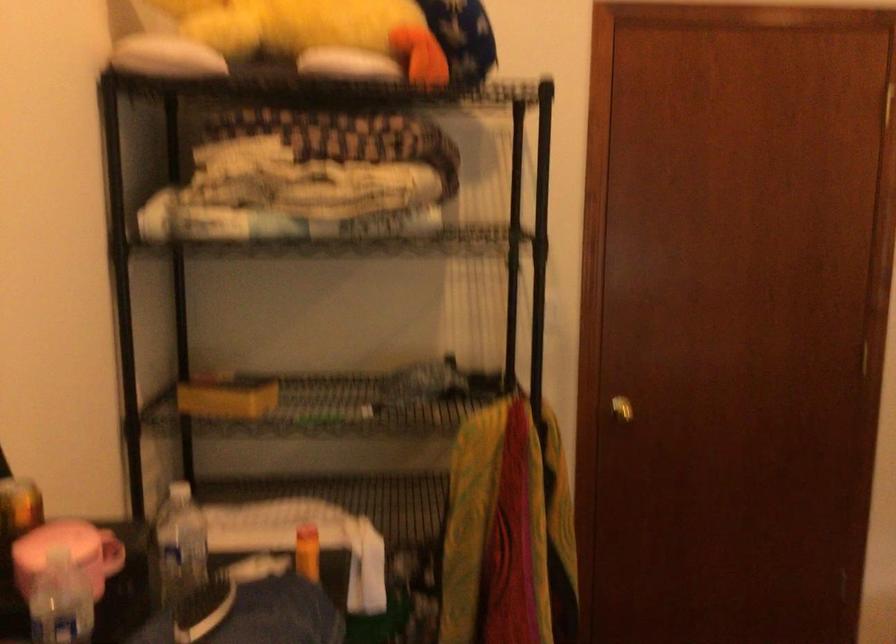
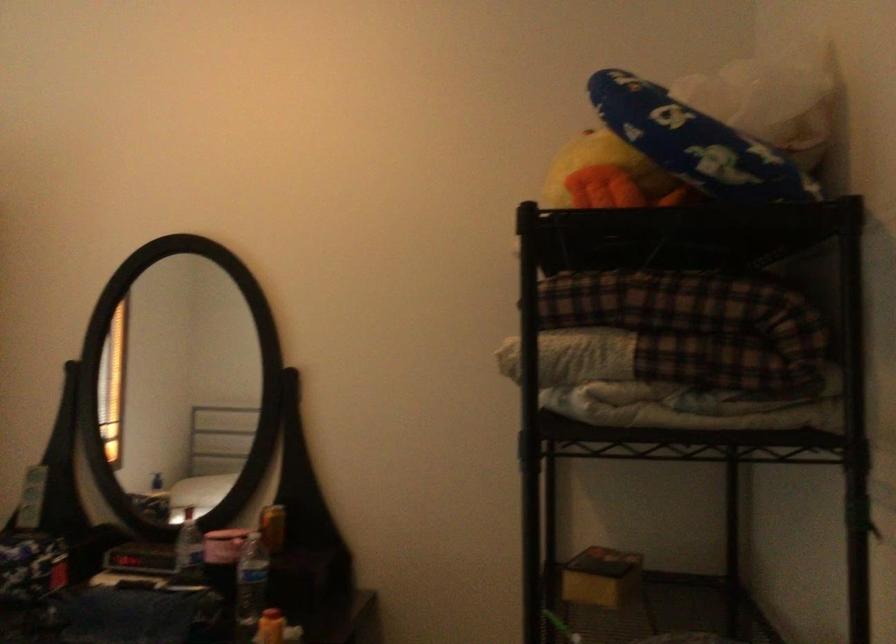
Locate, in the second image, the point that corresponds to pixel 309 552 in the first image.

(270, 627)